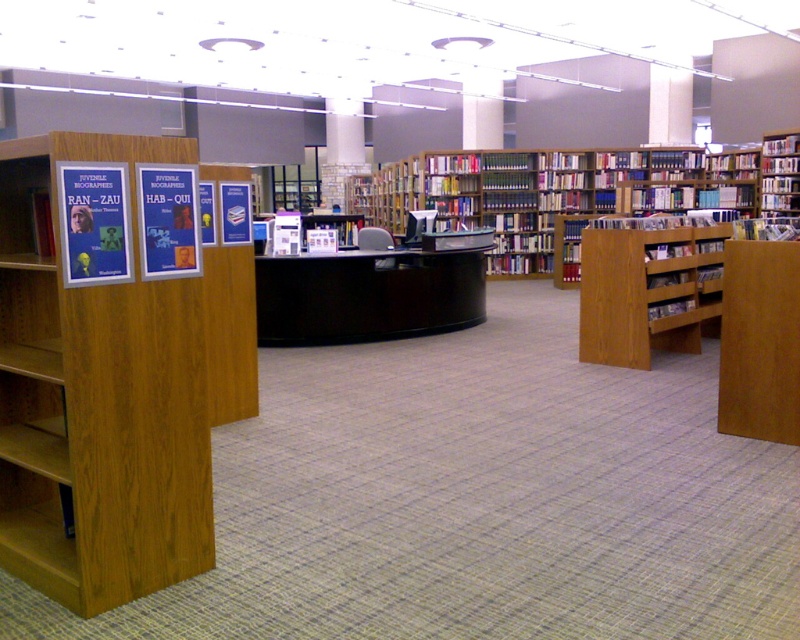
Question: Which object is the farthest from the light brown wood bookcase at left?

Choices:
 (A) wooden bookshelf at center
 (B) hardcover book at right
 (C) wooden bookshelf at upper right

Answer: (C)

Question: Is light brown wood bookcase at left closer to camera compared to blue paper sign at left?

Choices:
 (A) yes
 (B) no

Answer: (A)

Question: Can you confirm if light brown wood bookcase at left is positioned above hardcover book at center?

Choices:
 (A) yes
 (B) no

Answer: (B)

Question: Which object appears farthest from the camera in this image?

Choices:
 (A) hardcover book at right
 (B) hardcover book at upper right
 (C) hardcover book at center
 (D) blue paper sign at left

Answer: (B)

Question: Does wooden bookshelf at upper right have a lesser width compared to matte brown book at center?

Choices:
 (A) yes
 (B) no

Answer: (A)

Question: Among these points, which one is farthest from the camera?

Choices:
 (A) (792, 145)
 (B) (72, 300)
 (C) (782, 209)

Answer: (C)